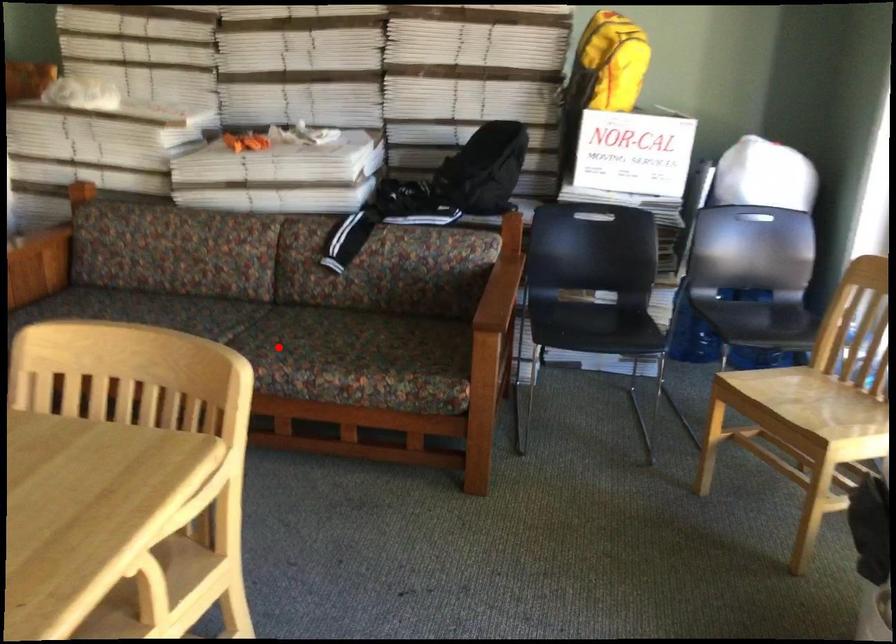
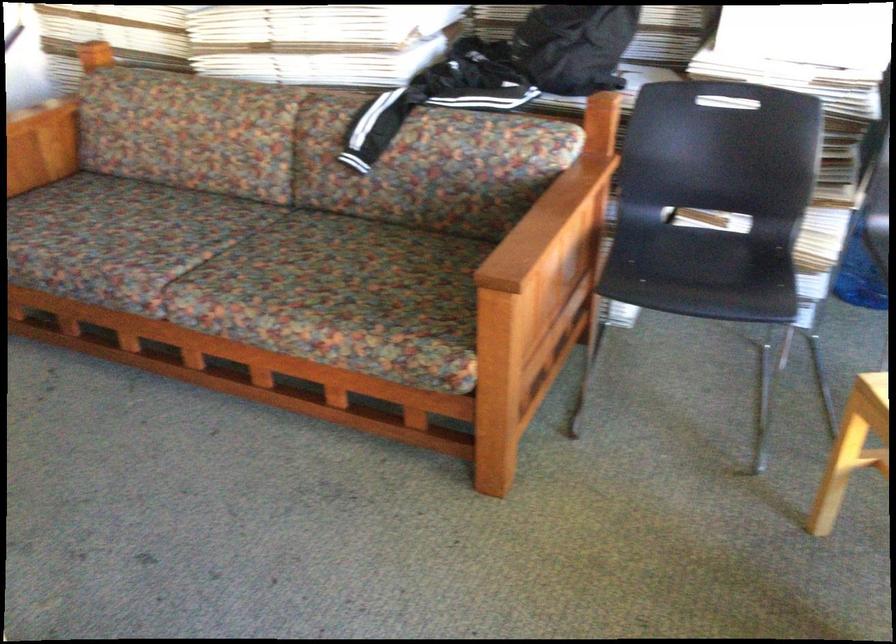
Question: I am providing you with two images of the same scene from different viewpoints. A red point is shown in image1. For the corresponding object point in image2, is it positioned nearer or farther from the camera?

Choices:
 (A) Nearer
 (B) Farther

Answer: (A)